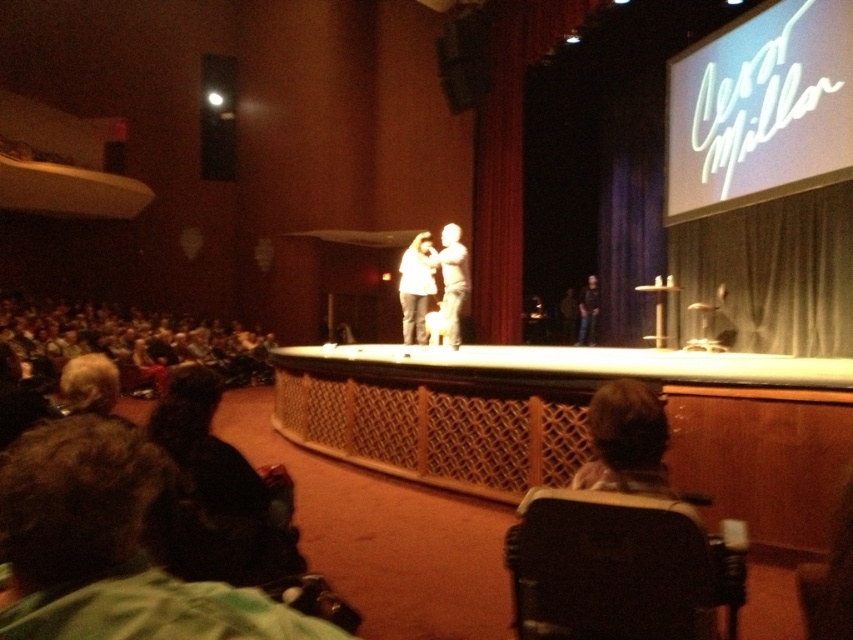
You are sitting in the black plastic chair at lower right and want to hand a note to the black fabric person at center. Can you reach them directly without getting up?

The black plastic chair at lower right is closer to the viewer than the black fabric person at center, so you would need to get up to reach them as they are farther away.

You are an event organizer who needs to identify the tallest shirt among two white shirts on stage for a costume check. Which one is taller between the white fabric shirt at center and the white matte shirt at center?

The white fabric shirt at center is taller than the white matte shirt at center according to the description.

You are sitting in the audience of the theater and notice two white shirts at the center of the stage. The first is labeled as a white fabric shirt at center, and the second is labeled as a white matte shirt at center. Which of these two shirts is positioned lower on the stage?

The white fabric shirt at center is located below the white matte shirt at center, so it is positioned lower on the stage.